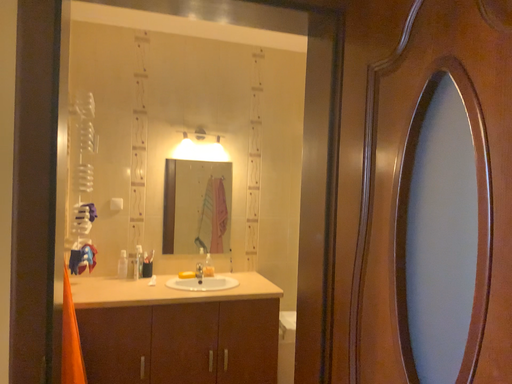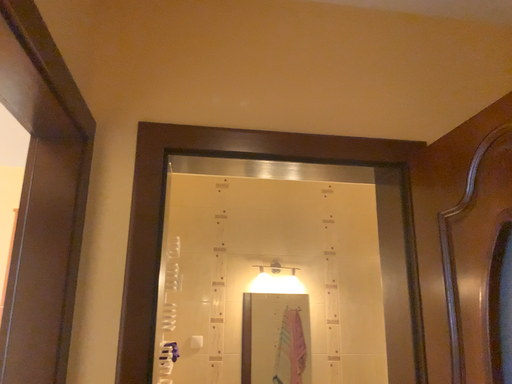
Question: Which way did the camera rotate in the video?

Choices:
 (A) rotated right
 (B) rotated left

Answer: (B)